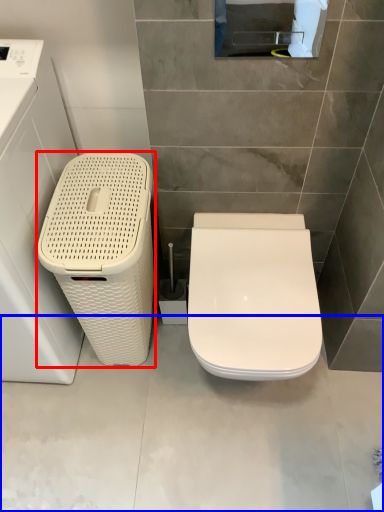
Question: Which of the following is the farthest to the observer, dish washer (highlighted by a red box) or concrete (highlighted by a blue box)?

Choices:
 (A) dish washer
 (B) concrete

Answer: (B)